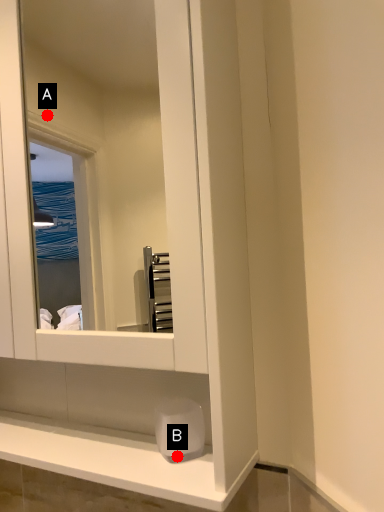
Question: Two points are circled on the image, labeled by A and B beside each circle. Which point is closer to the camera?

Choices:
 (A) A is closer
 (B) B is closer

Answer: (B)